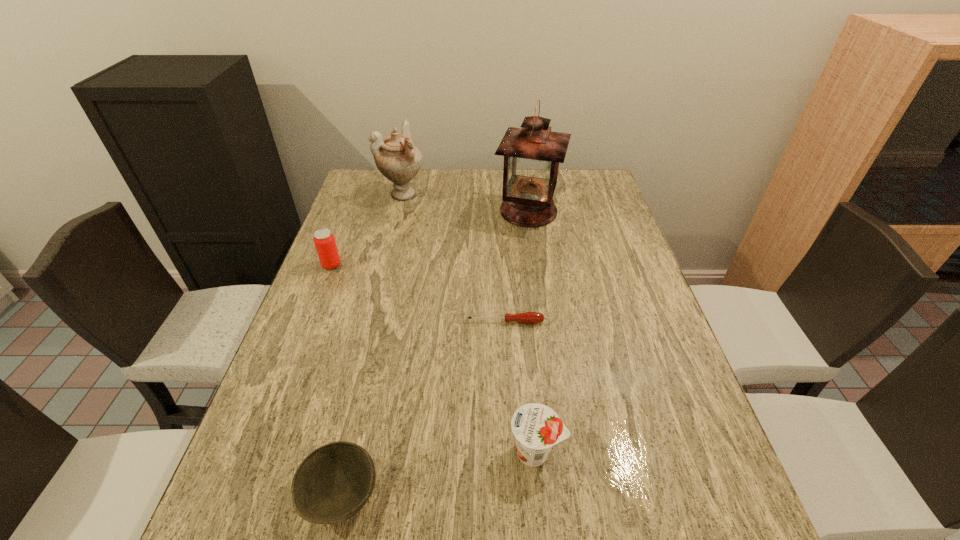
Where is `vacant region located 0.120m on the right of the leftmost object`? vacant region located 0.120m on the right of the leftmost object is located at coordinates (383, 265).

Locate an element on the screen. free location located 0.100m on the back of the yogurt is located at coordinates (529, 387).

Where is `vacant space situated on the back of the bowl`? This screenshot has height=540, width=960. vacant space situated on the back of the bowl is located at coordinates pyautogui.click(x=358, y=419).

Identify the location of vacant space positioned on the back of the shortest object. This screenshot has width=960, height=540. [503, 285].

Where is `oil lamp present at the far edge`? oil lamp present at the far edge is located at coordinates (532, 154).

I want to click on urn that is at the far edge, so 396,157.

Locate an element on the screen. This screenshot has height=540, width=960. object positioned at the near edge is located at coordinates (333, 483).

Image resolution: width=960 pixels, height=540 pixels. I want to click on urn located in the left edge section of the desktop, so click(396, 157).

You are a GUI agent. You are given a task and a screenshot of the screen. Output one action in this format:
    pyautogui.click(x=<x>, y=<y>)
    Task: Click on the beer can at the left edge
    This screenshot has width=960, height=540.
    Given the screenshot: What is the action you would take?
    coord(324,240)

Locate an element on the screen. This screenshot has height=540, width=960. bowl situated at the left edge is located at coordinates (333, 483).